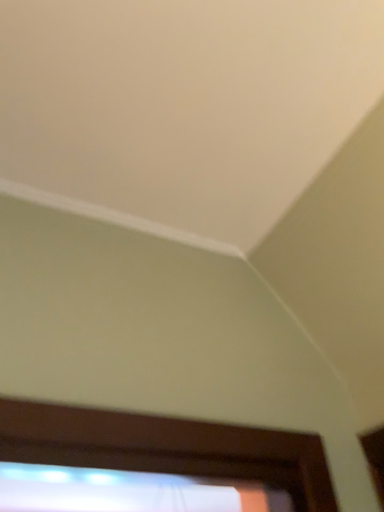
Find the location of a particular element. The height and width of the screenshot is (512, 384). brown wooden window at lower center is located at coordinates (167, 448).

Measure the distance between point (309, 506) and camera.

Point (309, 506) and camera are 28.94 inches apart.

This screenshot has width=384, height=512. Describe the element at coordinates (167, 448) in the screenshot. I see `brown wooden window at lower center` at that location.

The image size is (384, 512). Identify the location of brown wooden window at lower center. tap(167, 448).